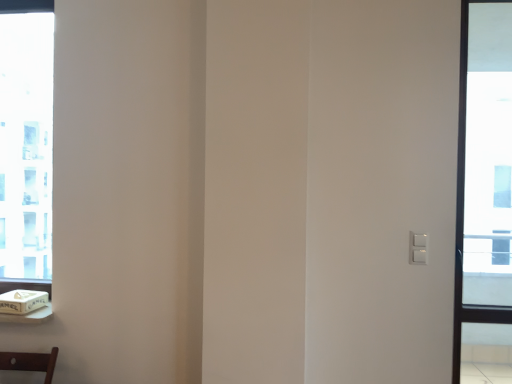
Question: Considering the relative sizes of clear glass window at left, the 2th window in the right-to-left sequence, and white cardboard box at lower left in the image provided, is clear glass window at left, the 2th window in the right-to-left sequence, shorter than white cardboard box at lower left?

Choices:
 (A) yes
 (B) no

Answer: (B)

Question: Is clear glass window at left, the 2th window in the right-to-left sequence, positioned with its back to white cardboard box at lower left?

Choices:
 (A) yes
 (B) no

Answer: (B)

Question: Is clear glass window at left, the 1th window positioned from the left, thinner than white cardboard box at lower left?

Choices:
 (A) yes
 (B) no

Answer: (A)

Question: Does clear glass window at left, positioned as the first window in back-to-front order, appear on the left side of white cardboard box at lower left?

Choices:
 (A) yes
 (B) no

Answer: (A)

Question: From a real-world perspective, is clear glass window at left, the 1th window positioned from the left, under white cardboard box at lower left?

Choices:
 (A) yes
 (B) no

Answer: (B)

Question: Is point (7, 309) positioned closer to the camera than point (10, 150)?

Choices:
 (A) closer
 (B) farther

Answer: (A)

Question: From the image's perspective, relative to clear glass window at left, arranged as the second window when viewed from the front, is white cardboard box at lower left above or below?

Choices:
 (A) above
 (B) below

Answer: (B)

Question: Is white cardboard box at lower left spatially inside clear glass window at left, the 1th window positioned from the left, or outside of it?

Choices:
 (A) inside
 (B) outside

Answer: (B)

Question: Is white cardboard box at lower left in front of or behind clear glass window at left, arranged as the second window when viewed from the front, in the image?

Choices:
 (A) front
 (B) behind

Answer: (A)

Question: Do you think clear glass window at left, the 1th window positioned from the left, is within transparent glass window at right, which appears as the second window when viewed from the back, or outside of it?

Choices:
 (A) outside
 (B) inside

Answer: (A)

Question: From the image's perspective, relative to transparent glass window at right, which appears as the second window when viewed from the back, is clear glass window at left, the 1th window positioned from the left, above or below?

Choices:
 (A) below
 (B) above

Answer: (B)

Question: In terms of size, does clear glass window at left, arranged as the second window when viewed from the front, appear bigger or smaller than transparent glass window at right, the first window from the front?

Choices:
 (A) small
 (B) big

Answer: (A)

Question: Relative to transparent glass window at right, the first window from the front, is clear glass window at left, the 1th window positioned from the left, in front or behind?

Choices:
 (A) front
 (B) behind

Answer: (B)

Question: Looking at their shapes, would you say transparent glass window at right, the first window from the front, is wider or thinner than clear glass window at left, the 1th window positioned from the left?

Choices:
 (A) thin
 (B) wide

Answer: (B)

Question: From the image's perspective, relative to clear glass window at left, positioned as the first window in back-to-front order, is transparent glass window at right, the 2th window viewed from the left, above or below?

Choices:
 (A) below
 (B) above

Answer: (A)